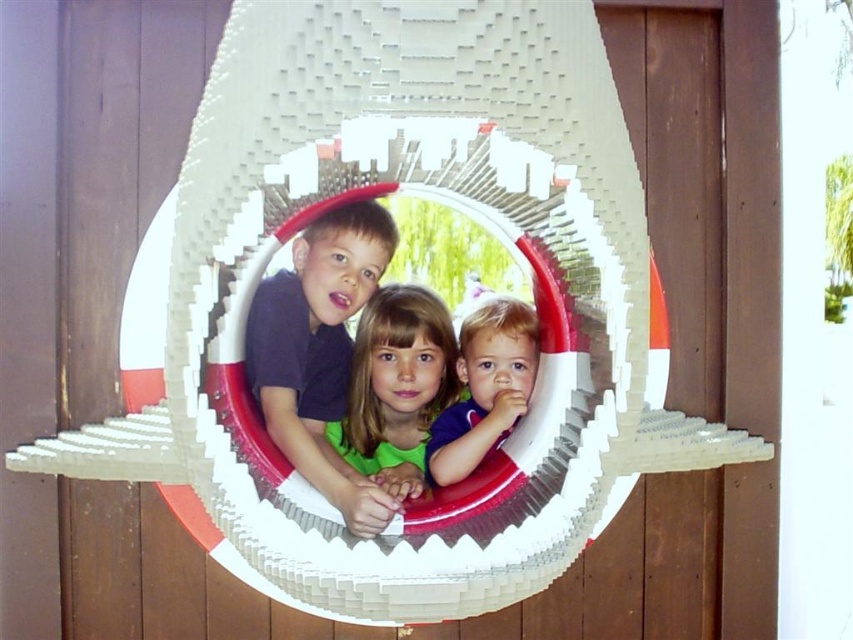
Question: Does matte black shirt at center appear on the right side of smooth green shirt at center?

Choices:
 (A) no
 (B) yes

Answer: (A)

Question: Is the position of matte black shirt at center more distant than that of smooth green shirt at center?

Choices:
 (A) no
 (B) yes

Answer: (A)

Question: Which of these objects is positioned closest to the smooth green shirt at center?

Choices:
 (A) smooth purple shirt at center
 (B) matte black shirt at center

Answer: (A)

Question: Does matte black shirt at center have a larger size compared to smooth purple shirt at center?

Choices:
 (A) yes
 (B) no

Answer: (A)

Question: Among these objects, which one is farthest from the camera?

Choices:
 (A) matte black shirt at center
 (B) smooth purple shirt at center
 (C) smooth green shirt at center

Answer: (B)

Question: Which object is positioned farthest from the matte black shirt at center?

Choices:
 (A) smooth purple shirt at center
 (B) smooth green shirt at center

Answer: (A)